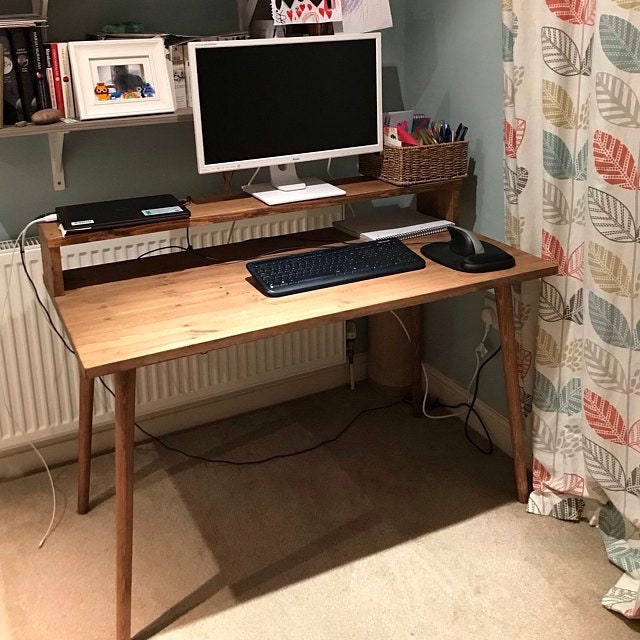
You are a GUI agent. You are given a task and a screenshot of the screen. Output one action in this format:
    pyautogui.click(x=<x>, y=<y>)
    Task: Click on the heater
    
    Given the screenshot: What is the action you would take?
    pyautogui.click(x=35, y=381)